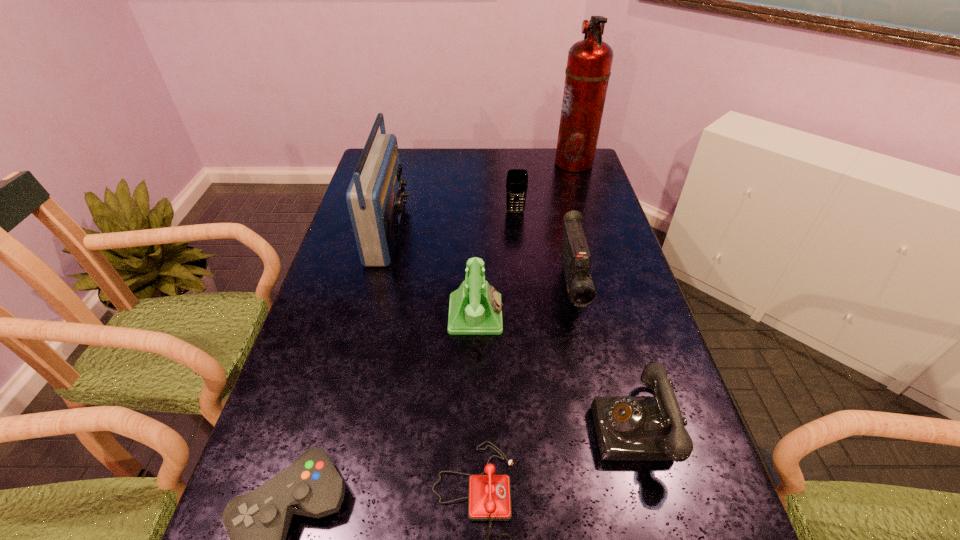
I want to click on fire extinguisher, so click(x=589, y=62).

Image resolution: width=960 pixels, height=540 pixels. I want to click on the tallest object, so click(x=589, y=62).

This screenshot has width=960, height=540. What are the coordinates of `the second tallest object` in the screenshot? It's located at (375, 197).

I want to click on camcorder, so click(x=576, y=259).

I want to click on cellular telephone, so click(x=517, y=179).

Find the location of a particular element. This screenshot has width=960, height=540. the farthest telephone is located at coordinates (475, 308).

This screenshot has width=960, height=540. In order to click on the rightmost telephone in this screenshot , I will do `click(629, 428)`.

Identify the location of vacant region located 0.210m on the nozzle side of the farthest object. (500, 163).

You are a GUI agent. You are given a task and a screenshot of the screen. Output one action in this format:
    pyautogui.click(x=<x>, y=<y>)
    Task: Click on the vacant area situated 0.250m on the nozzle side of the farthest object
    The image size is (960, 540).
    Given the screenshot: What is the action you would take?
    pyautogui.click(x=490, y=163)

Where is `blank space located 0.140m on the nozzle side of the farthest object`? The image size is (960, 540). blank space located 0.140m on the nozzle side of the farthest object is located at coordinates (518, 163).